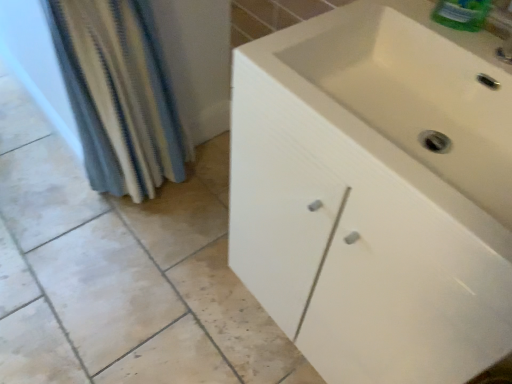
At what (x,y) coordinates should I click in order to perform the action: click on vacant space positioned to the left of blue striped fabric at left. Please return your answer as a coordinate pair (x, y). Looking at the image, I should click on (50, 201).